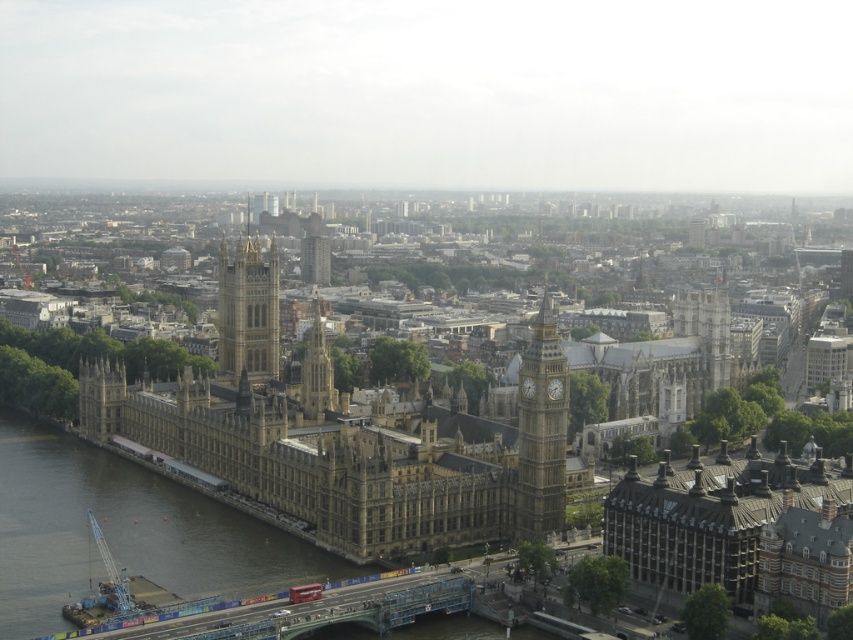
Consider the image. Between smooth concrete waterway at lower left and golden stone tower at center, which one appears on the left side from the viewer's perspective?

Positioned to the left is smooth concrete waterway at lower left.

Measure the distance from smooth concrete waterway at lower left to golden stone tower at center.

smooth concrete waterway at lower left is 163.48 feet from golden stone tower at center.

Where is `smooth concrete waterway at lower left`? The width and height of the screenshot is (853, 640). smooth concrete waterway at lower left is located at coordinates (125, 531).

Image resolution: width=853 pixels, height=640 pixels. Identify the location of smooth concrete waterway at lower left. (125, 531).

Can you confirm if stone clock tower at center-right is positioned to the right of golden stone tower at center?

Correct, you'll find stone clock tower at center-right to the right of golden stone tower at center.

Can you confirm if stone clock tower at center-right is wider than golden stone tower at center?

No, stone clock tower at center-right is not wider than golden stone tower at center.

Image resolution: width=853 pixels, height=640 pixels. I want to click on stone clock tower at center-right, so click(x=541, y=429).

Find the location of `stone clock tower at center-right`. stone clock tower at center-right is located at coordinates (541, 429).

Does dark gray stone building at lower right appear over stone clock tower at center-right?

Incorrect, dark gray stone building at lower right is not positioned above stone clock tower at center-right.

Does dark gray stone building at lower right have a greater width compared to stone clock tower at center-right?

Correct, the width of dark gray stone building at lower right exceeds that of stone clock tower at center-right.

Between point (648, 508) and point (544, 449), which one is positioned in front?

Positioned in front is point (648, 508).

Find the location of a particular element. dark gray stone building at lower right is located at coordinates (712, 516).